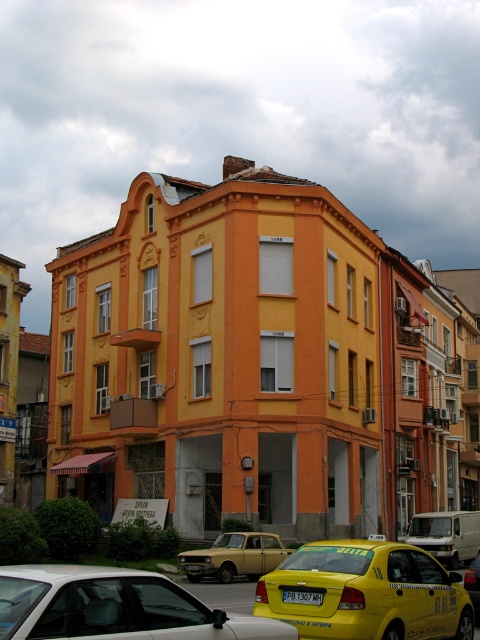
You are standing in front of the corner building with a vibrant orange facade. You see two yellow matte taxis. Which one is nearer to you, the yellow matte taxi at lower right or the yellow matte taxi at center?

The yellow matte taxi at lower right is closer to the viewer than the yellow matte taxi at center.

You are a delivery person who needs to park a gold metallic sedan at center and a yellow metallic taxi at center in a parking lot with spaces that are exactly 2 meters wide. Which vehicle will fit into the parking spaces without needing to adjust its position?

The gold metallic sedan at center has a smaller width than the yellow metallic taxi at center, so the gold metallic sedan at center will fit into the 2 meter wide parking spaces without needing to adjust its position.